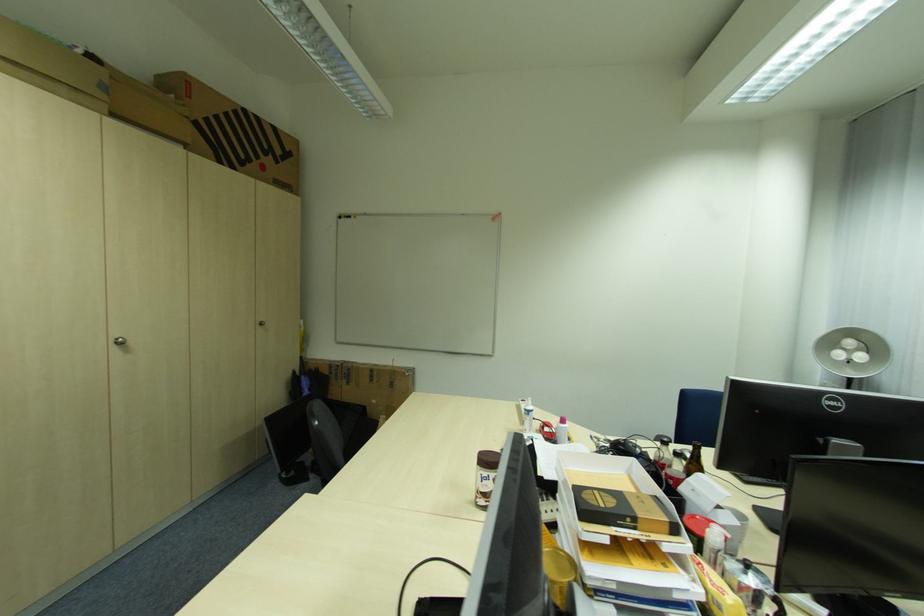
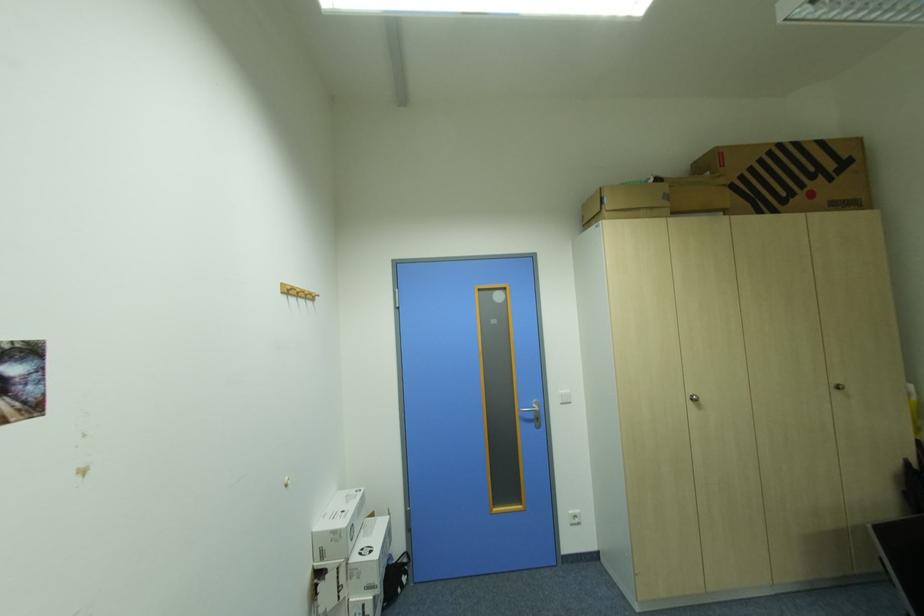
Find the pixel in the second image that matches pixel 265 323 in the first image.

(840, 386)